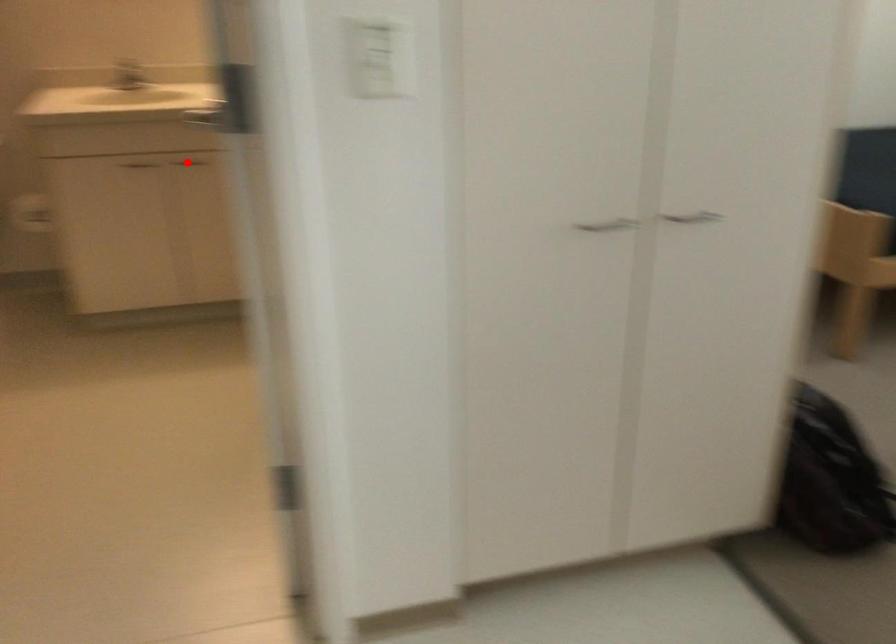
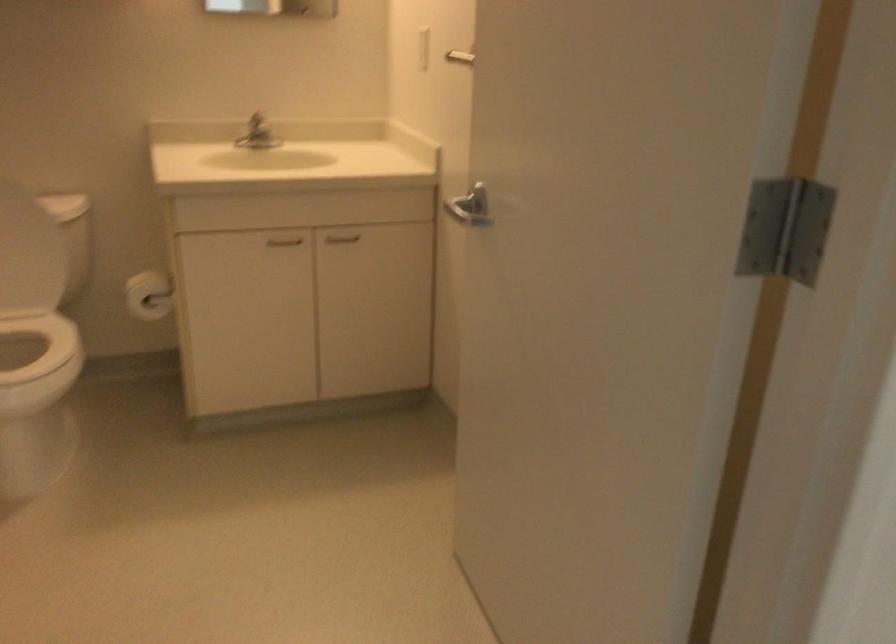
Locate, in the second image, the point that corresponds to the highlighted location in the first image.

(341, 238)